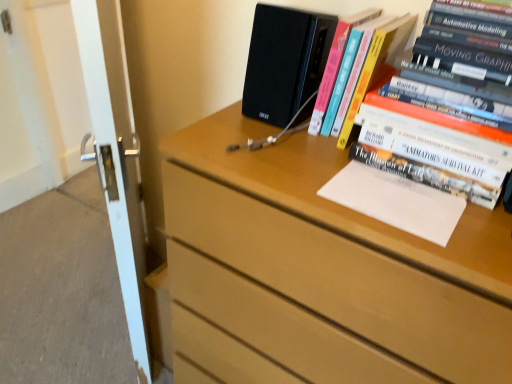
At what (x,y) coordinates should I click in order to perform the action: click on blank area to the left of white paper at upper right. Please return your answer as a coordinate pair (x, y). The image size is (512, 384). Looking at the image, I should click on (293, 175).